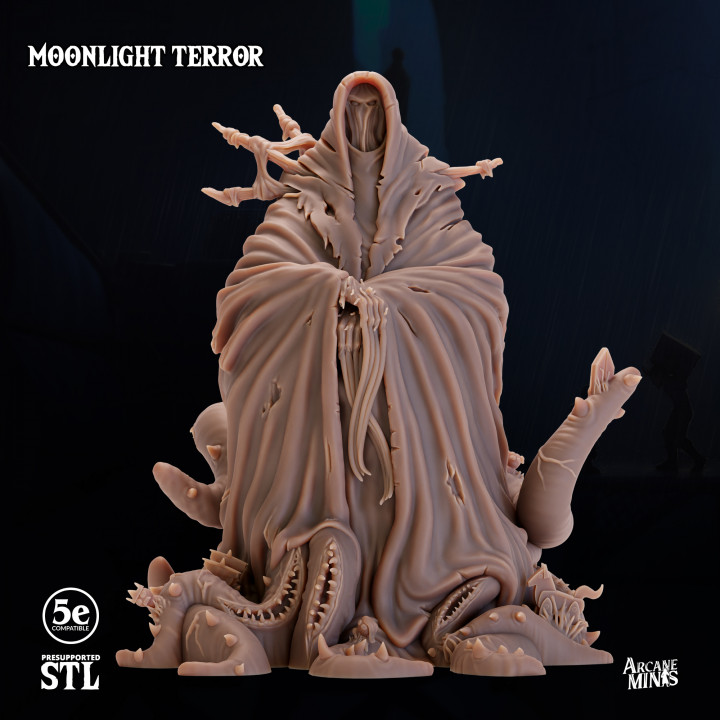
Locate an element on the screen. The width and height of the screenshot is (720, 720). hood is located at coordinates (392, 103), (336, 106).